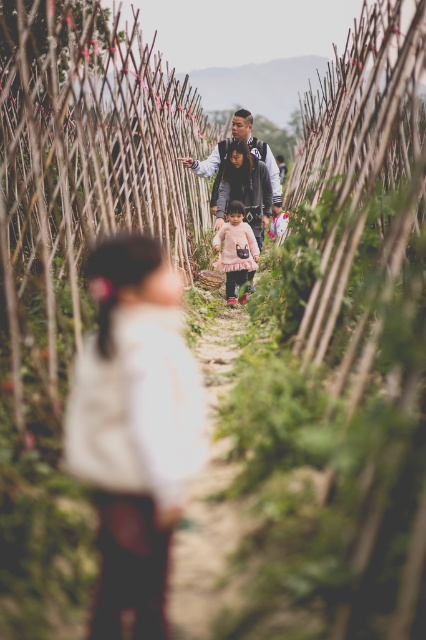
In the scene shown: Measure the distance between white soft sweater at center and camera.

They are 2.49 meters apart.

From the picture: Is white soft sweater at center in front of matte pink sweater at center?

That is True.

Is point (115, 637) less distant than point (236, 193)?

Yes, it is.

Find the location of a particular element. white soft sweater at center is located at coordinates (135, 428).

Measure the distance between matte pink sweater at center and pink tulle dress at center.

The distance of matte pink sweater at center from pink tulle dress at center is 22.67 inches.

Between point (264, 168) and point (253, 243), which one is positioned behind?

Positioned behind is point (264, 168).

Who is more distant from viewer, (241, 176) or (242, 218)?

The point (241, 176) is more distant.

You are a GUI agent. You are given a task and a screenshot of the screen. Output one action in this format:
    pyautogui.click(x=<x>, y=<y>)
    Task: Click on the matte pink sweater at center
    
    Given the screenshot: What is the action you would take?
    pyautogui.click(x=244, y=186)

Is matte pink sweater at center to the left of dark gray jacket at center from the viewer's perspective?

In fact, matte pink sweater at center is to the right of dark gray jacket at center.

This screenshot has height=640, width=426. Describe the element at coordinates (244, 186) in the screenshot. I see `matte pink sweater at center` at that location.

The height and width of the screenshot is (640, 426). Identify the location of matte pink sweater at center. (244, 186).